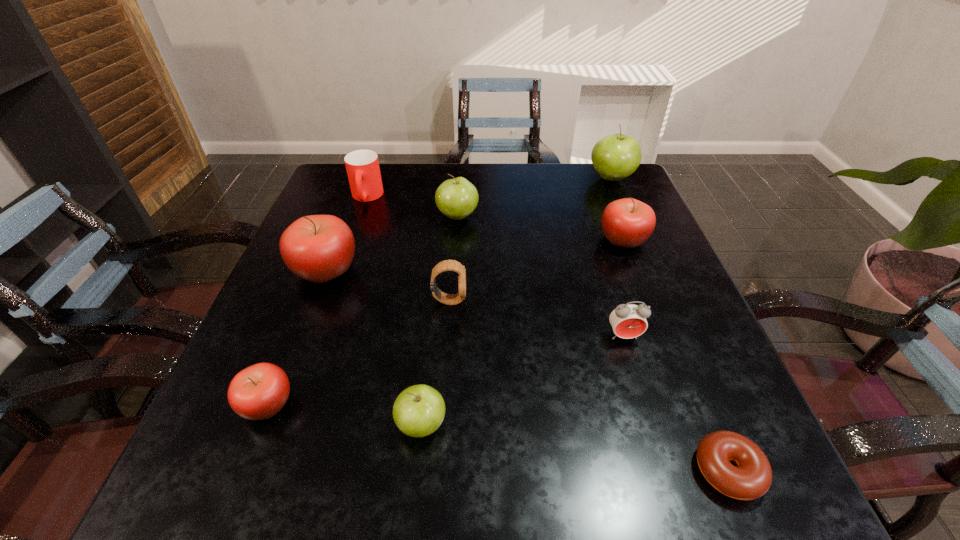
Where is `free point between the nearest green apple and the watch`? free point between the nearest green apple and the watch is located at coordinates (436, 362).

This screenshot has height=540, width=960. Identify the location of free space between the second farthest green apple and the red cup. (412, 207).

This screenshot has height=540, width=960. What are the coordinates of `free space between the smallest green apple and the farthest apple` in the screenshot? It's located at (516, 301).

Locate an element on the screen. vacant point located between the cup and the biggest green apple is located at coordinates (489, 188).

Locate an element on the screen. The image size is (960, 540). free space between the biggest red apple and the nearest red apple is located at coordinates pyautogui.click(x=297, y=337).

Locate which object ranks eighth in proximity to the second smallest green apple. Please provide its 2D coordinates. Your answer should be formatted as a tuple, i.e. [(x, y)], where the tuple contains the x and y coordinates of a point satisfying the conditions above.

[(258, 392)]

Where is `object that can be found as the sixth closest to the farthest green apple`? The image size is (960, 540). object that can be found as the sixth closest to the farthest green apple is located at coordinates (318, 248).

Locate an element on the screen. apple that is the closest to the smallest green apple is located at coordinates (258, 392).

Select which apple appears as the closest to the farthest apple. Please provide its 2D coordinates. Your answer should be formatted as a tuple, i.e. [(x, y)], where the tuple contains the x and y coordinates of a point satisfying the conditions above.

[(627, 222)]

Where is `green apple identified as the closest to the second biggest red apple`? The height and width of the screenshot is (540, 960). green apple identified as the closest to the second biggest red apple is located at coordinates (614, 157).